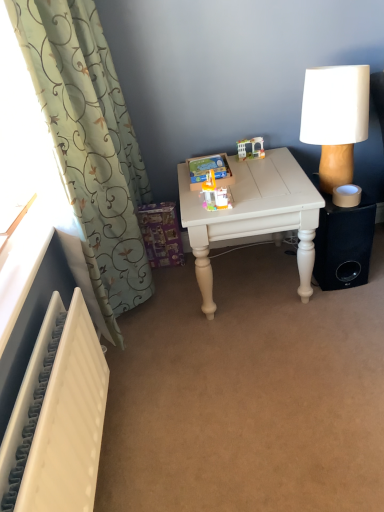
I want to click on vacant space to the right of translucent plastic toy house at upper center, the 1th toy in the top-to-bottom sequence, so click(275, 154).